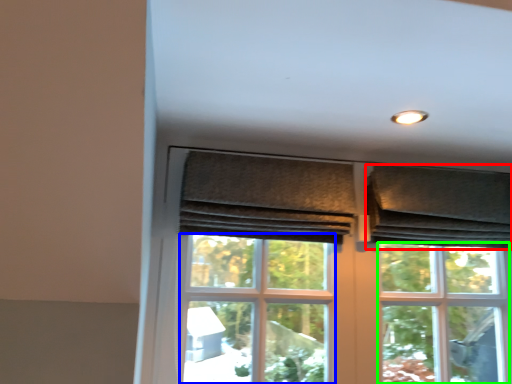
Question: Considering the real-world distances, which object is closest to curtain (highlighted by a red box)? screen door (highlighted by a blue box) or bay window (highlighted by a green box).

Choices:
 (A) screen door
 (B) bay window

Answer: (B)